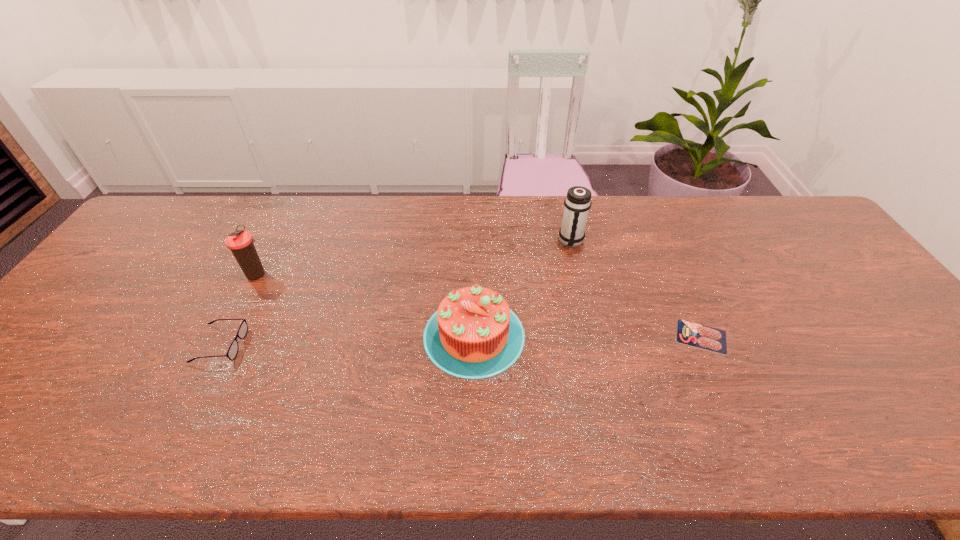
You are a GUI agent. You are given a task and a screenshot of the screen. Output one action in this format:
    pyautogui.click(x=<x>, y=<y>)
    Task: Click on the free point located 0.310m on the back of the left thermos bottle
    The height and width of the screenshot is (540, 960).
    Given the screenshot: What is the action you would take?
    pyautogui.click(x=293, y=203)

You are a GUI agent. You are given a task and a screenshot of the screen. Output one action in this format:
    pyautogui.click(x=<x>, y=<y>)
    Task: Click on the vacant space situated on the right of the third tallest object
    The image size is (960, 540).
    Given the screenshot: What is the action you would take?
    pyautogui.click(x=592, y=335)

Locate an element on the screen. Image resolution: width=960 pixels, height=540 pixels. vacant point located on the front-facing side of the spectacles is located at coordinates (263, 345).

This screenshot has width=960, height=540. I want to click on vacant space located 0.360m on the back of the shortest object, so click(x=655, y=232).

I want to click on object that is at the far edge, so click(577, 203).

In the image, there is a desktop. At what (x,y) coordinates should I click in order to perform the action: click on vacant space at the far edge. Please return your answer as a coordinate pair (x, y). Looking at the image, I should click on (401, 224).

Where is `free space at the near edge`? free space at the near edge is located at coordinates (98, 448).

The width and height of the screenshot is (960, 540). I want to click on vacant space at the left edge of the desktop, so click(x=40, y=379).

Identify the location of empty location between the farther thermos bottle and the spectacles. The image size is (960, 540). (396, 293).

Where is `vacant area that lies between the second shortest object and the second object from right to left`? The height and width of the screenshot is (540, 960). vacant area that lies between the second shortest object and the second object from right to left is located at coordinates (396, 293).